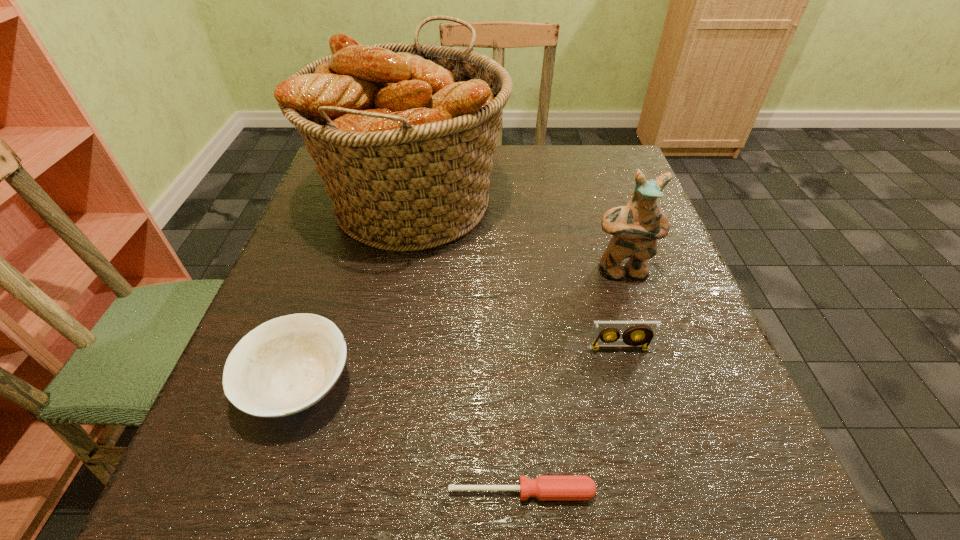
This screenshot has height=540, width=960. Find the location of `vacant space that is in between the fourth shortest object and the nearest object`. vacant space that is in between the fourth shortest object and the nearest object is located at coordinates (571, 381).

Identify the location of vacant region between the shortest object and the bowl. (411, 438).

At what (x,y) coordinates should I click in order to perform the action: click on vacant area that lies between the bowl and the videotape. Please return your answer as a coordinate pair (x, y). Image resolution: width=960 pixels, height=540 pixels. Looking at the image, I should click on (459, 367).

Where is `free space that is in between the fourth shortest object and the videotape`? The height and width of the screenshot is (540, 960). free space that is in between the fourth shortest object and the videotape is located at coordinates (620, 309).

Find the location of a particular element. The height and width of the screenshot is (540, 960). object that can be found as the fourth closest to the figurine is located at coordinates (287, 364).

At what (x,y) coordinates should I click in order to perform the action: click on the closest object relative to the tallest object. Please return your answer as a coordinate pair (x, y). This screenshot has width=960, height=540. Looking at the image, I should click on (636, 227).